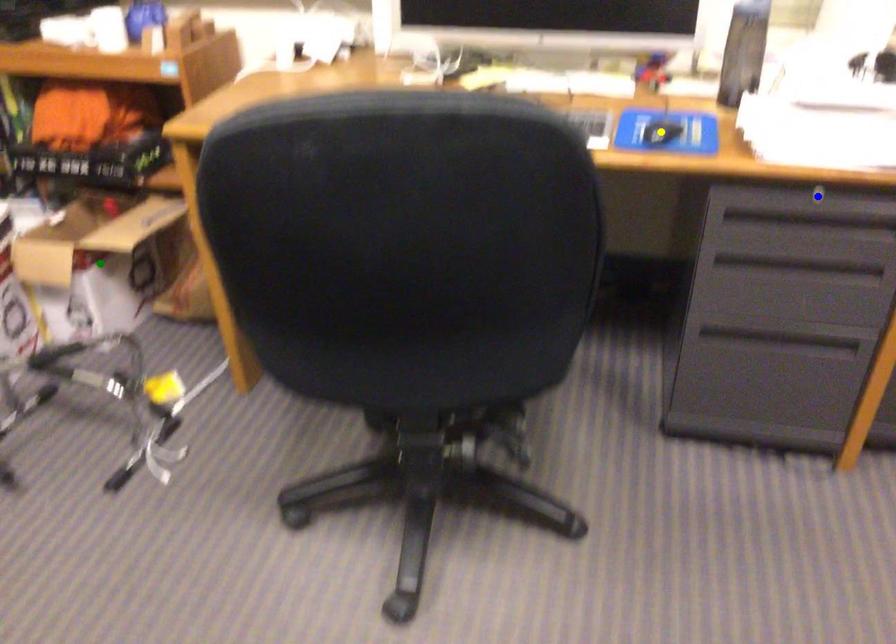
Order these from nearest to farthest:
blue point, yellow point, green point

green point
yellow point
blue point